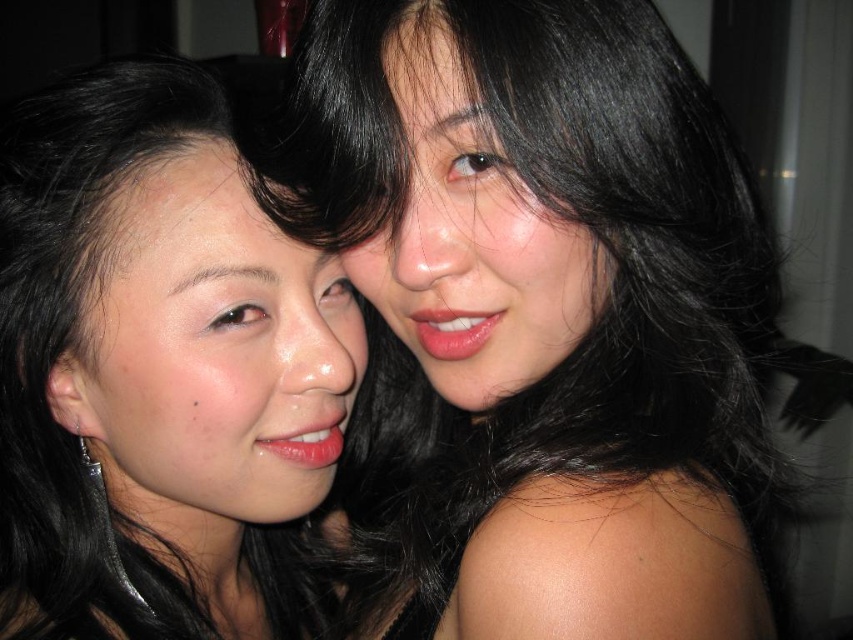
Question: Which point is closer to the camera taking this photo?

Choices:
 (A) (280, 445)
 (B) (445, 328)
 (C) (492, 244)
 (D) (602, 81)

Answer: (D)

Question: In this image, where is smooth skin face at upper right located relative to matte pink lipstick at center?

Choices:
 (A) left
 (B) right

Answer: (A)

Question: Can you confirm if smooth skin face at center is bigger than matte black hair at left?

Choices:
 (A) yes
 (B) no

Answer: (A)

Question: Considering the relative positions of smooth skin face at upper right and matte pink lipstick at center in the image provided, where is smooth skin face at upper right located with respect to matte pink lipstick at center?

Choices:
 (A) below
 (B) above

Answer: (B)

Question: Which object is the closest to the matte black hair at left?

Choices:
 (A) smooth skin face at left
 (B) matte pink lipstick at lower left
 (C) smooth skin face at upper right

Answer: (A)

Question: Which point is farther to the camera?

Choices:
 (A) (323, 256)
 (B) (462, 257)

Answer: (A)